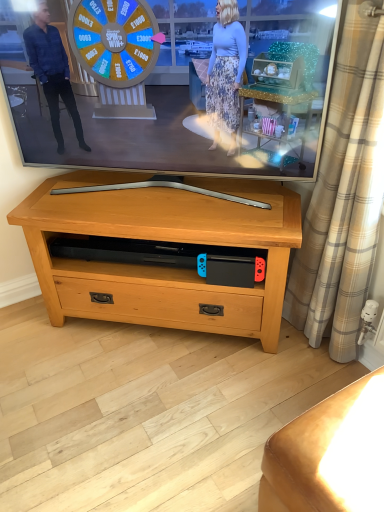
What is the approximate height of pine wood tv stand at center?

pine wood tv stand at center is 22.70 inches in height.

At what (x,y) coordinates should I click in order to perform the action: click on matte black tv at center. Please return your answer as a coordinate pair (x, y). Looking at the image, I should click on (174, 86).

From the image's perspective, is beige plaid curtain at right on top of leather couch at lower right?

Indeed, from the image's perspective, beige plaid curtain at right is shown above leather couch at lower right.

Is beige plaid curtain at right not inside leather couch at lower right?

beige plaid curtain at right lies outside leather couch at lower right's area.

Looking at this image, from a real-world perspective, is beige plaid curtain at right on leather couch at lower right?

Yes, from a real-world perspective, beige plaid curtain at right is over leather couch at lower right

Which is more to the left, beige plaid curtain at right or leather couch at lower right?

leather couch at lower right is more to the left.

Does beige plaid curtain at right turn towards matte black tv at center?

No, beige plaid curtain at right is not oriented towards matte black tv at center.

Considering the positions of points (315, 342) and (28, 87), is point (315, 342) closer to camera compared to point (28, 87)?

No, it is behind (28, 87).

What are the coordinates of `television above the beige plaid curtain at right (from a real-world perspective)` in the screenshot? It's located at (174, 86).

Are beige plaid curtain at right and matte black tv at center making contact?

beige plaid curtain at right is not next to matte black tv at center, and they're not touching.

Is matte black tv at center at the left side of beige plaid curtain at right?

Yes, matte black tv at center is to the left of beige plaid curtain at right.

From a real-world perspective, which object stands above the other?

From a 3D spatial view, matte black tv at center is above.

Is matte black tv at center oriented away from beige plaid curtain at right?

No, matte black tv at center's orientation is not away from beige plaid curtain at right.

Would you consider matte black tv at center to be distant from beige plaid curtain at right?

matte black tv at center is actually quite close to beige plaid curtain at right.

How many degrees apart are the facing directions of beige plaid curtain at right and pine wood tv stand at center?

48.2 degrees.

Locate an element on the screen. curtain above the pine wood tv stand at center (from a real-world perspective) is located at coordinates click(x=344, y=197).

How far apart are beige plaid curtain at right and pine wood tv stand at center?

45.16 centimeters.

Consider the image. In terms of size, does beige plaid curtain at right appear bigger or smaller than pine wood tv stand at center?

In the image, beige plaid curtain at right appears to be smaller than pine wood tv stand at center.

How much distance is there between matte black tv at center and leather couch at lower right?

matte black tv at center and leather couch at lower right are 3.36 feet apart.

Is matte black tv at center to the left of leather couch at lower right from the viewer's perspective?

Yes.

Consider the image. From the image's perspective, between matte black tv at center and leather couch at lower right, which one is located above?

matte black tv at center appears higher in the image.

From the picture: Is matte black tv at center surrounding leather couch at lower right?

No, leather couch at lower right is located outside of matte black tv at center.

Between point (277, 436) and point (151, 97), which one is positioned in front?

Point (277, 436)

From the image's perspective, which is above, leather couch at lower right or matte black tv at center?

From the image's view, matte black tv at center is above.

From a real-world perspective, is leather couch at lower right physically located above or below matte black tv at center?

Clearly, from a real-world perspective, leather couch at lower right is below matte black tv at center.

Can you confirm if leather couch at lower right is bigger than matte black tv at center?

No, leather couch at lower right is not bigger than matte black tv at center.

Which of these two, pine wood tv stand at center or matte black tv at center, stands taller?

Standing taller between the two is matte black tv at center.

Based on the photo, between pine wood tv stand at center and matte black tv at center, which one has larger size?

pine wood tv stand at center is bigger.

From the image's perspective, is pine wood tv stand at center over matte black tv at center?

Incorrect, from the image's perspective, pine wood tv stand at center is lower than matte black tv at center.

Is pine wood tv stand at center looking in the opposite direction of matte black tv at center?

No, matte black tv at center is not at the back of pine wood tv stand at center.

What are the coordinates of `curtain positioned vertically above the leather couch at lower right (from a real-world perspective)` in the screenshot? It's located at (344, 197).

Where is `curtain below the matte black tv at center (from the image's perspective)`? This screenshot has height=512, width=384. curtain below the matte black tv at center (from the image's perspective) is located at coordinates pos(344,197).

From the picture: Looking at the image, which one is located closer to beige plaid curtain at right, leather couch at lower right or pine wood tv stand at center?

pine wood tv stand at center.

From the image, which object appears to be nearer to leather couch at lower right, beige plaid curtain at right or matte black tv at center?

The object closer to leather couch at lower right is beige plaid curtain at right.

Estimate the real-world distances between objects in this image. Which object is further from matte black tv at center, leather couch at lower right or beige plaid curtain at right?

leather couch at lower right.

From the image, which object appears to be nearer to beige plaid curtain at right, pine wood tv stand at center or leather couch at lower right?

pine wood tv stand at center lies closer to beige plaid curtain at right than the other object.

Which object lies nearer to the anchor point matte black tv at center, leather couch at lower right or pine wood tv stand at center?

pine wood tv stand at center.

Which object lies nearer to the anchor point pine wood tv stand at center, beige plaid curtain at right or matte black tv at center?

matte black tv at center is positioned closer to the anchor pine wood tv stand at center.

Based on their spatial positions, is pine wood tv stand at center or matte black tv at center further from beige plaid curtain at right?

matte black tv at center is further to beige plaid curtain at right.

Looking at the image, which one is located closer to leather couch at lower right, matte black tv at center or pine wood tv stand at center?

pine wood tv stand at center.

The height and width of the screenshot is (512, 384). Identify the location of curtain between matte black tv at center and leather couch at lower right from top to bottom. (344, 197).

Locate an element on the screen. This screenshot has width=384, height=512. table located between matte black tv at center and beige plaid curtain at right in the left-right direction is located at coordinates (x=164, y=241).

Identify the location of table between matte black tv at center and leather couch at lower right in the up-down direction. (164, 241).

Where is `furniture between pine wood tv stand at center and beige plaid curtain at right from left to right`? The width and height of the screenshot is (384, 512). furniture between pine wood tv stand at center and beige plaid curtain at right from left to right is located at coordinates (308, 455).